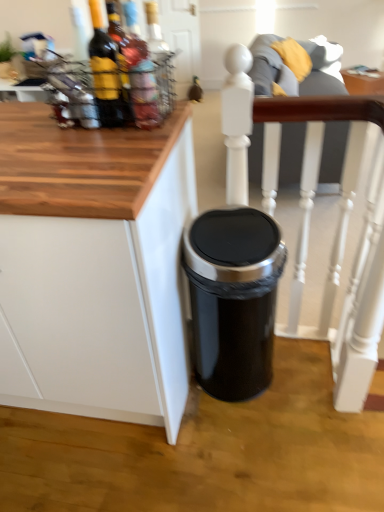
Question: Are white matte cabinet at lower right and black metallic trash can at center located far from each other?

Choices:
 (A) no
 (B) yes

Answer: (A)

Question: Are white matte cabinet at lower right and black metallic trash can at center beside each other?

Choices:
 (A) yes
 (B) no

Answer: (B)

Question: Is white matte cabinet at lower right shorter than black metallic trash can at center?

Choices:
 (A) yes
 (B) no

Answer: (B)

Question: Could you tell me if white matte cabinet at lower right is turned towards black metallic trash can at center?

Choices:
 (A) yes
 (B) no

Answer: (B)

Question: Does white matte cabinet at lower right lie in front of black metallic trash can at center?

Choices:
 (A) yes
 (B) no

Answer: (A)

Question: Based on their sizes in the image, would you say translucent glass bottle at upper left, which is the third bottle in left-to-right order, is bigger or smaller than white matte cabinet at lower right?

Choices:
 (A) big
 (B) small

Answer: (B)

Question: In terms of width, does translucent glass bottle at upper left, which is the third bottle in left-to-right order, look wider or thinner when compared to white matte cabinet at lower right?

Choices:
 (A) wide
 (B) thin

Answer: (B)

Question: In the image, is translucent glass bottle at upper left, which is the third bottle in left-to-right order, on the left side or the right side of white matte cabinet at lower right?

Choices:
 (A) left
 (B) right

Answer: (B)

Question: Is point (162, 76) closer or farther from the camera than point (3, 371)?

Choices:
 (A) closer
 (B) farther

Answer: (A)

Question: From a real-world perspective, relative to matte glass bottle at upper left, positioned as the 1th bottle in left-to-right order, is matte glass bottle at upper left, which is the 2th bottle in right-to-left order, vertically above or below?

Choices:
 (A) below
 (B) above

Answer: (A)

Question: From their relative heights in the image, would you say matte glass bottle at upper left, which is the second bottle from left to right, is taller or shorter than matte glass bottle at upper left, positioned as the 1th bottle in left-to-right order?

Choices:
 (A) short
 (B) tall

Answer: (A)

Question: Relative to matte glass bottle at upper left, positioned as the 3th bottle in right-to-left order, is matte glass bottle at upper left, which is the 2th bottle in right-to-left order, in front or behind?

Choices:
 (A) front
 (B) behind

Answer: (A)

Question: From the image's perspective, relative to matte glass bottle at upper left, positioned as the 1th bottle in left-to-right order, is matte glass bottle at upper left, which is the 2th bottle in right-to-left order, above or below?

Choices:
 (A) above
 (B) below

Answer: (B)

Question: Is matte glass bottle at upper left, which is the second bottle from left to right, wider or thinner than white painted wood chair at center?

Choices:
 (A) thin
 (B) wide

Answer: (A)

Question: Is matte glass bottle at upper left, which is the 2th bottle in right-to-left order, in front of or behind white painted wood chair at center in the image?

Choices:
 (A) front
 (B) behind

Answer: (A)